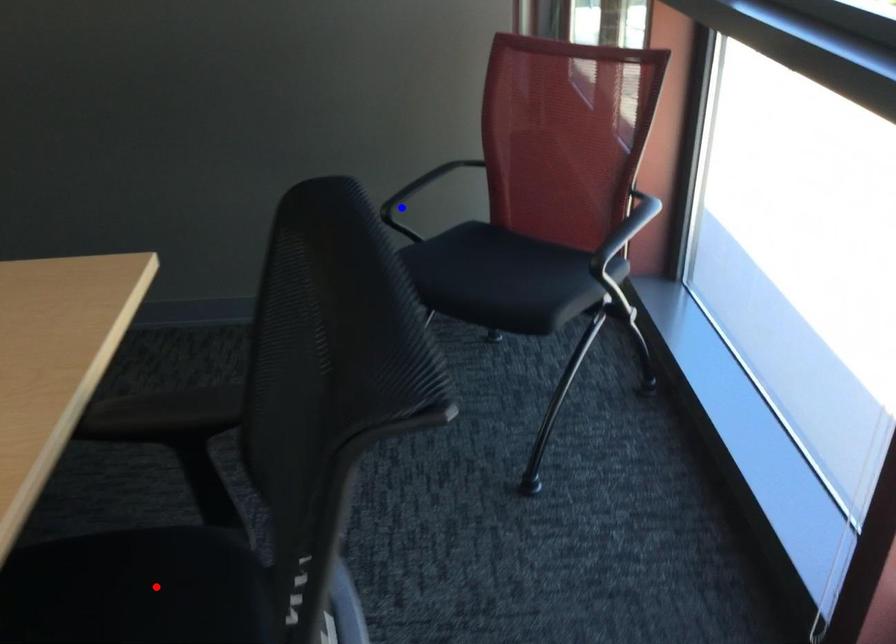
Question: In the image, two points are highlighted. Which point is nearer to the camera? Reply with the corresponding letter.

Choices:
 (A) blue point
 (B) red point

Answer: (B)